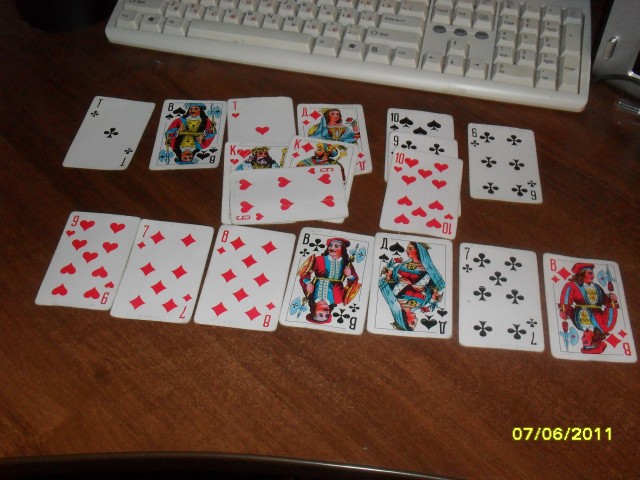
What are the coordinates of `power cord` in the screenshot? It's located at (630, 78).